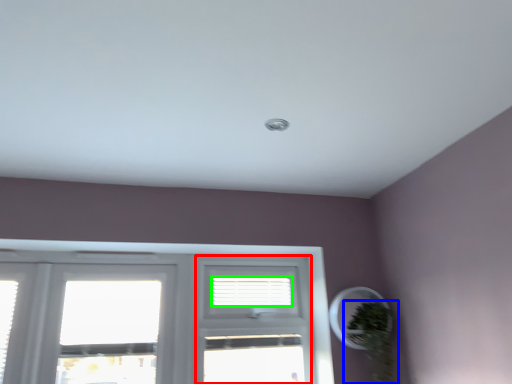
Question: Considering the real-world distances, which object is farthest from screen door (highlighted by a red box)? houseplant (highlighted by a blue box) or blind (highlighted by a green box)?

Choices:
 (A) houseplant
 (B) blind

Answer: (A)